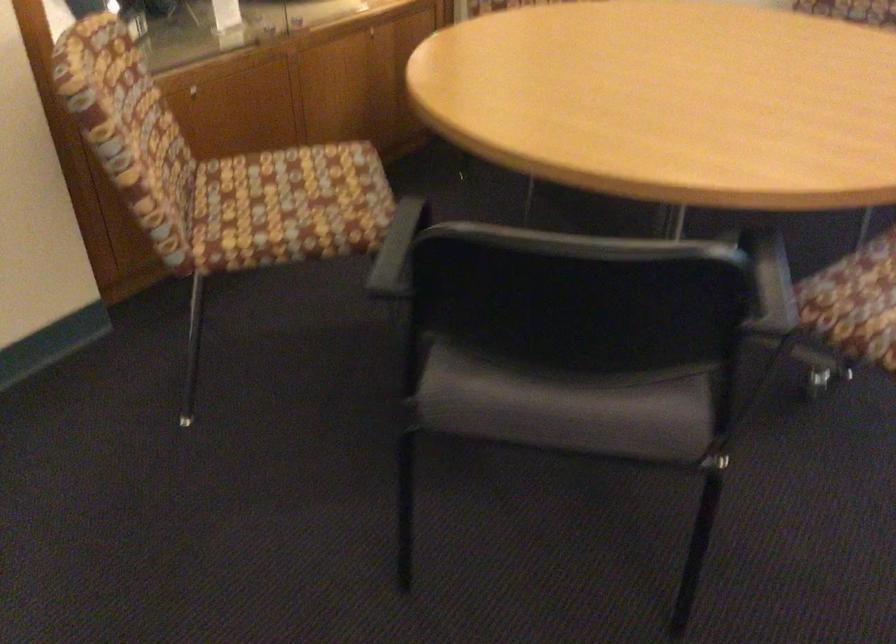
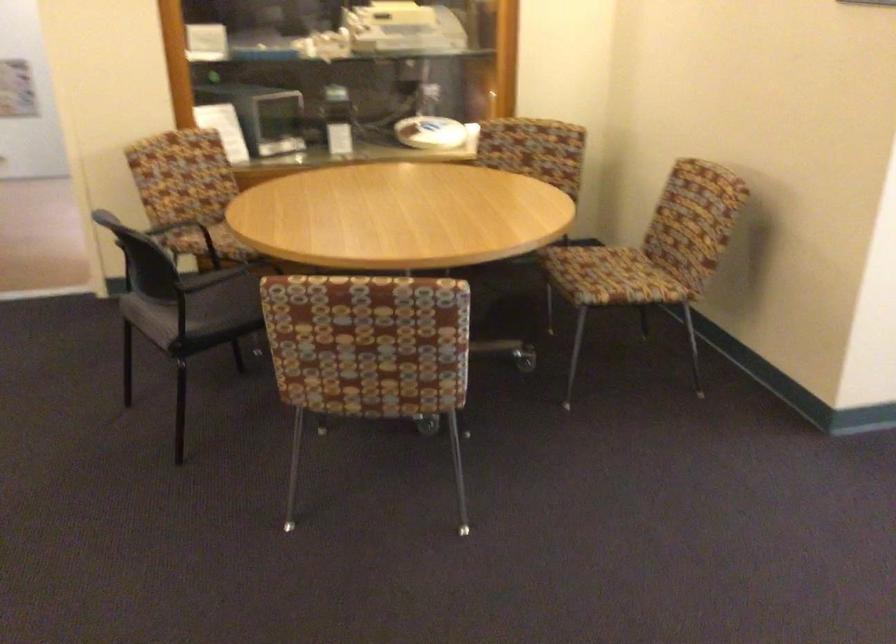
Where in the second image is the point corresponding to pixel 643 187 from the first image?

(228, 229)